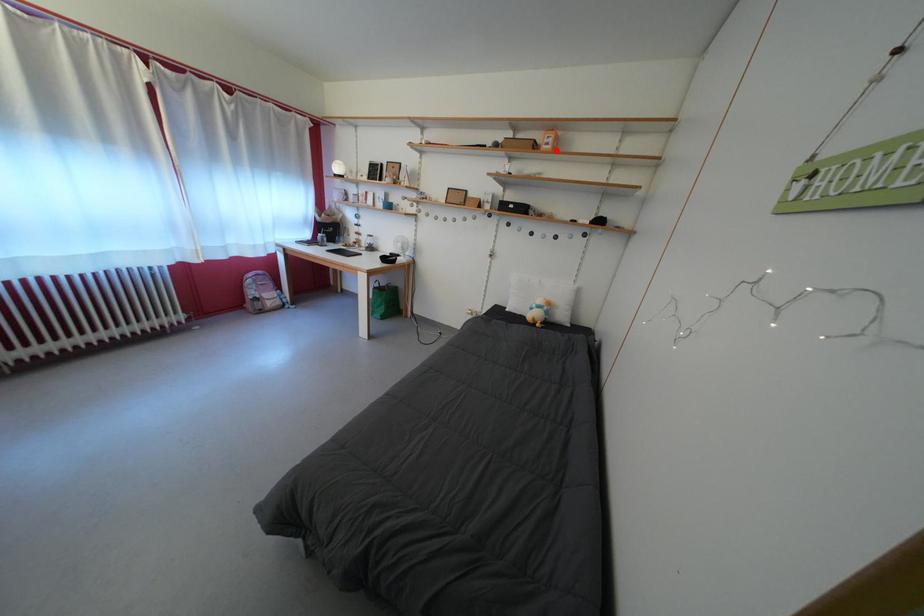
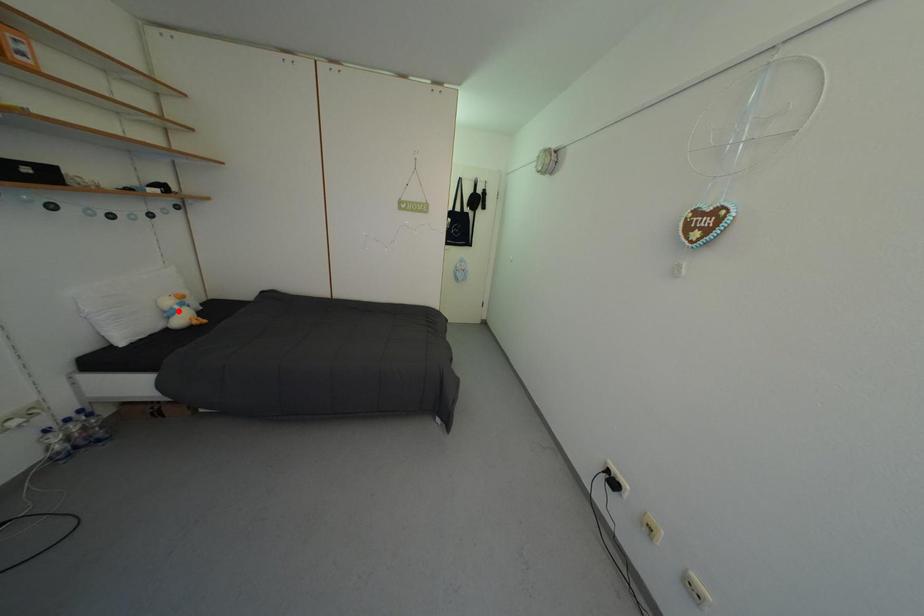
I am providing you with two images of the same scene from different viewpoints. A red point is marked on the first image and another point is marked on the second image. Are the points marked in image1 and image2 representing the same 3D position?

No